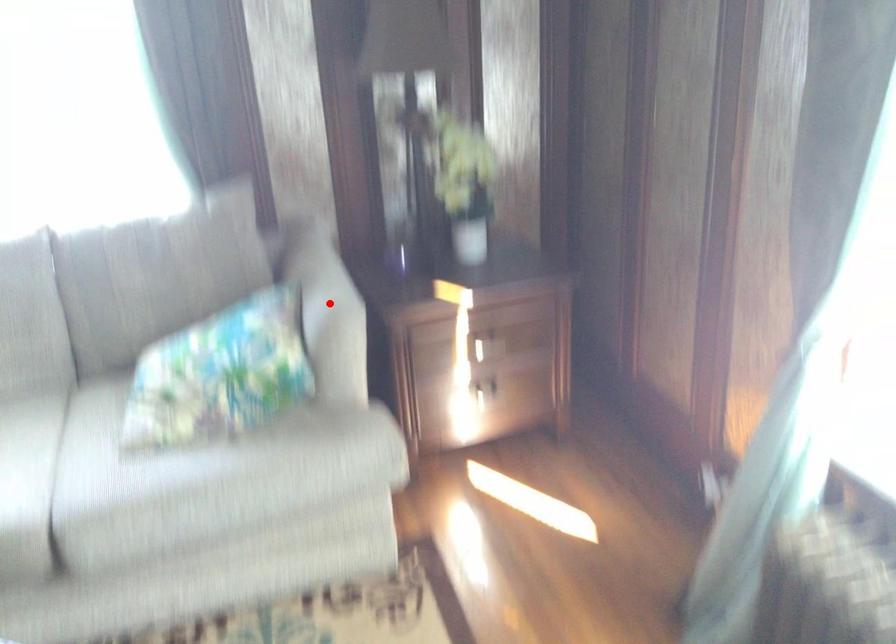
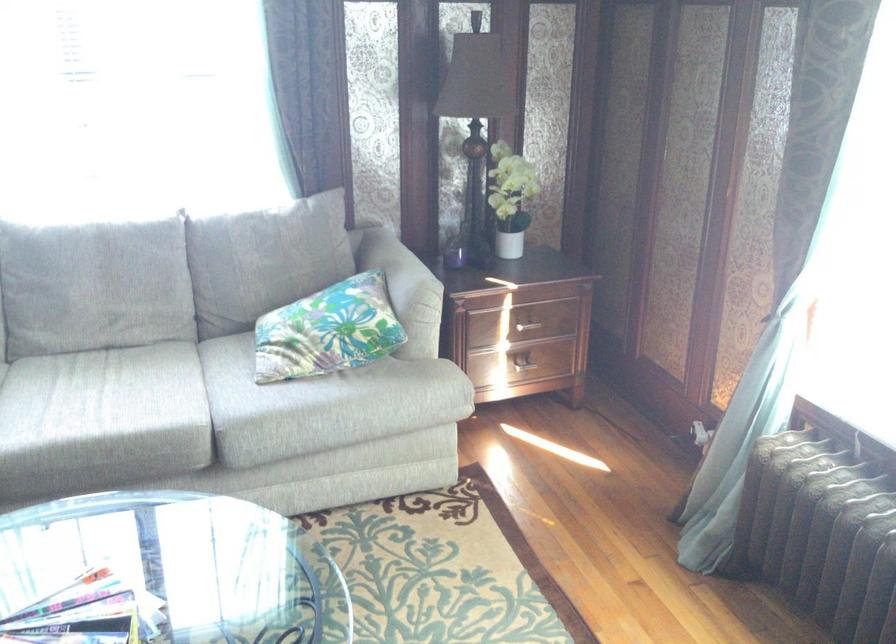
Question: I am providing you with two images of the same scene from different viewpoints. A red point is shown in image1. For the corresponding object point in image2, is it positioned nearer or farther from the camera?

Choices:
 (A) Nearer
 (B) Farther

Answer: (B)